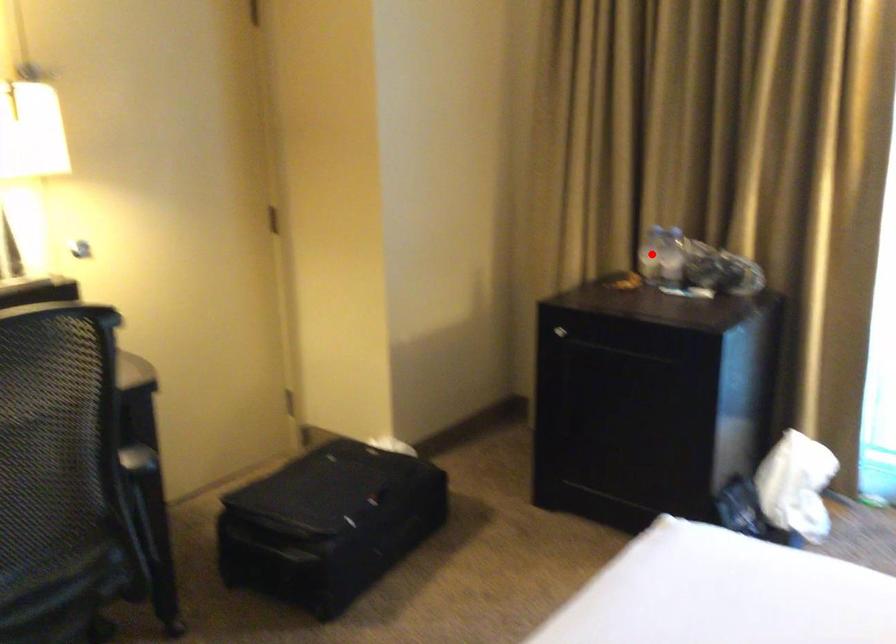
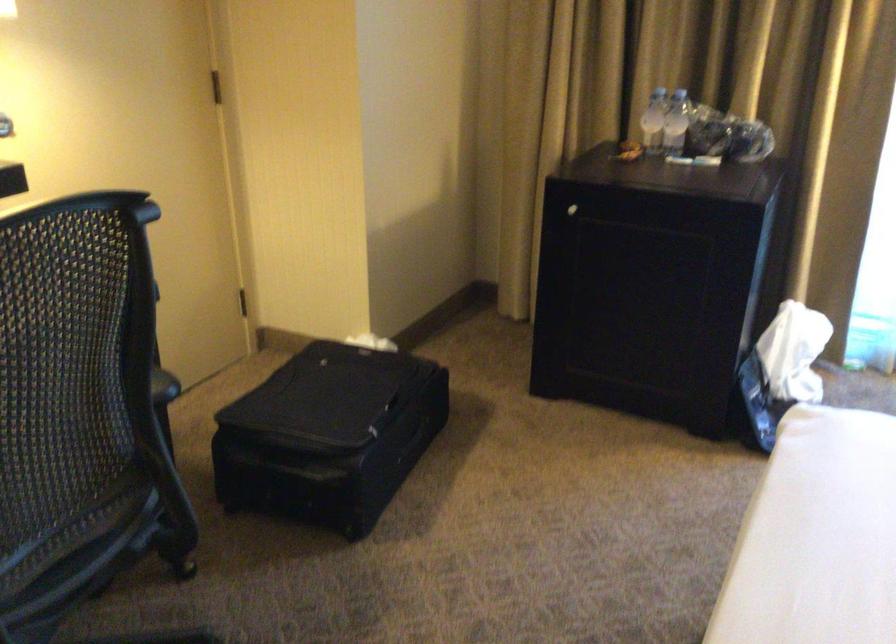
Where in the second image is the point corresponding to the highlighted location from the first image?

(653, 120)